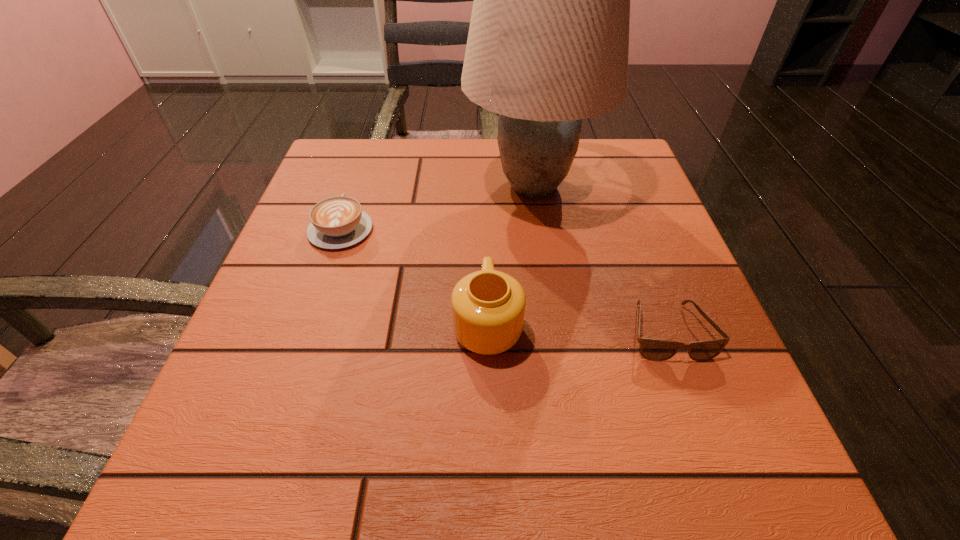
You are a GUI agent. You are given a task and a screenshot of the screen. Output one action in this format:
    pyautogui.click(x=<x>, y=<y>)
    Task: Click on the vacant space at the right edge
    The height and width of the screenshot is (540, 960).
    Given the screenshot: What is the action you would take?
    pyautogui.click(x=658, y=381)

The height and width of the screenshot is (540, 960). Find the location of `vacant space at the far left corner of the desktop`. vacant space at the far left corner of the desktop is located at coordinates (383, 180).

Locate an element on the screen. vacant space at the near left corner is located at coordinates (195, 449).

This screenshot has width=960, height=540. Identify the location of vacant space at the far right corner. (607, 176).

At what (x,y) coordinates should I click in order to perform the action: click on vacant space in between the cappuccino and the second tallest object. Please return your answer as a coordinate pair (x, y). The image size is (960, 540). Looking at the image, I should click on (415, 276).

Identify the location of free point between the tallest object and the sunglasses. [x=601, y=259].

Find the location of a particular element. This screenshot has height=540, width=960. unoccupied area between the mug and the sunglasses is located at coordinates (578, 328).

This screenshot has height=540, width=960. I want to click on vacant area between the sunglasses and the lampshade, so click(601, 259).

Locate an element on the screen. The height and width of the screenshot is (540, 960). vacant region between the lampshade and the sunglasses is located at coordinates (601, 259).

I want to click on free space between the sunglasses and the third shortest object, so click(578, 328).